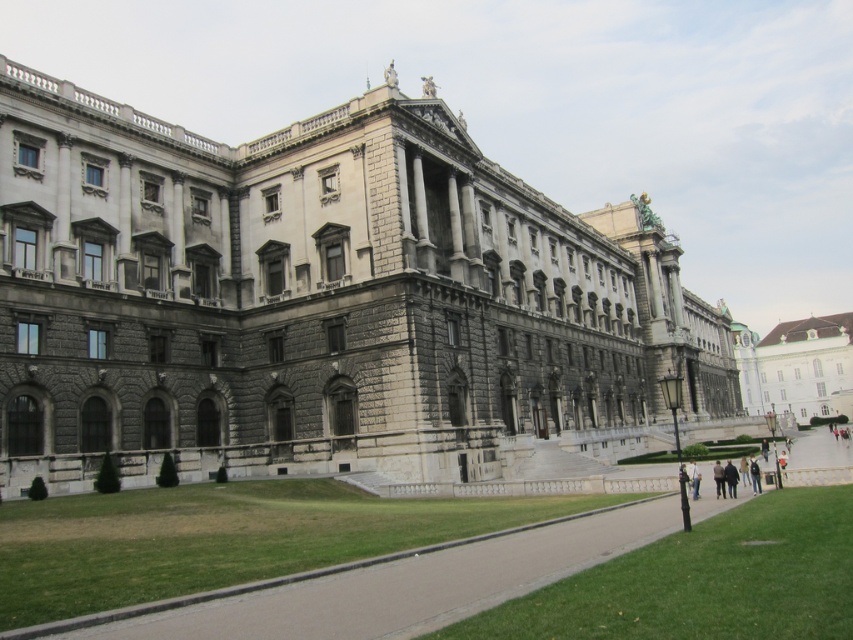
Question: Does white glossy palace at right appear over light brown leather jacket at lower right?

Choices:
 (A) yes
 (B) no

Answer: (A)

Question: Is gray stone building at center below dark brown leather jacket at lower right?

Choices:
 (A) yes
 (B) no

Answer: (B)

Question: Which point is closer to the camera?

Choices:
 (A) (503, 406)
 (B) (730, 464)
 (C) (715, 477)

Answer: (C)

Question: Can you confirm if gray stone building at center is positioned above light brown leather jacket at lower right?

Choices:
 (A) no
 (B) yes

Answer: (B)

Question: Which of the following is the farthest from the observer?

Choices:
 (A) dark brown leather jacket at lower right
 (B) light brown leather jacket at lower right
 (C) gray stone building at center
 (D) white glossy palace at right

Answer: (D)

Question: Which of the following is the farthest from the observer?

Choices:
 (A) (825, 372)
 (B) (722, 468)

Answer: (A)